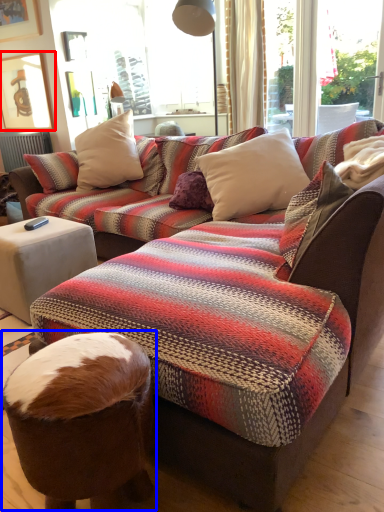
Question: Which of the following is the farthest to the observer, picture frame (highlighted by a red box) or bean bag chair (highlighted by a blue box)?

Choices:
 (A) picture frame
 (B) bean bag chair

Answer: (A)